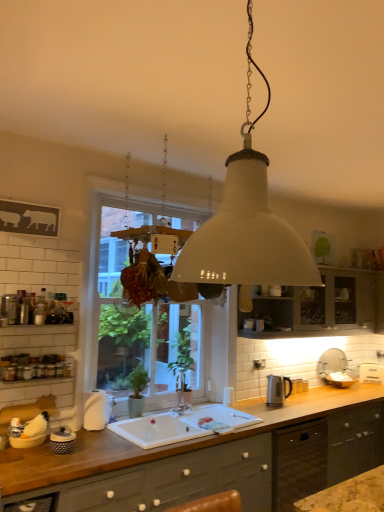
Question: Is matte gray cabinets at lower center, which is the 2th cabinetry from right to left, wider than white ceramic sink at center?

Choices:
 (A) no
 (B) yes

Answer: (B)

Question: From a real-world perspective, is matte gray cabinets at lower center, placed as the 2th cabinetry when sorted from top to bottom, over white ceramic sink at center?

Choices:
 (A) yes
 (B) no

Answer: (B)

Question: Could you tell me if matte gray cabinets at lower center, arranged as the first cabinetry when viewed from the front, is facing white ceramic sink at center?

Choices:
 (A) yes
 (B) no

Answer: (B)

Question: Is matte gray cabinets at lower center, the first cabinetry from the bottom, shorter than white ceramic sink at center?

Choices:
 (A) no
 (B) yes

Answer: (A)

Question: From the image's perspective, would you say matte gray cabinets at lower center, the 1th cabinetry positioned from the left, is positioned over white ceramic sink at center?

Choices:
 (A) no
 (B) yes

Answer: (A)

Question: Can you confirm if matte gray cabinets at lower center, the second cabinetry from the back, is taller than white ceramic sink at center?

Choices:
 (A) yes
 (B) no

Answer: (A)

Question: Can you confirm if white glass window at center is smaller than matte gray cabinet at center, positioned as the 1th cabinetry in back-to-front order?

Choices:
 (A) yes
 (B) no

Answer: (B)

Question: Is white glass window at center looking in the opposite direction of matte gray cabinet at center, positioned as the 1th cabinetry in back-to-front order?

Choices:
 (A) no
 (B) yes

Answer: (A)

Question: Could you tell me if white glass window at center is facing matte gray cabinet at center, positioned as the 2th cabinetry in left-to-right order?

Choices:
 (A) no
 (B) yes

Answer: (A)

Question: Is white glass window at center to the right of matte gray cabinet at center, the 2th cabinetry when ordered from bottom to top, from the viewer's perspective?

Choices:
 (A) no
 (B) yes

Answer: (A)

Question: From the image's perspective, is white glass window at center under matte gray cabinet at center, the second cabinetry when ordered from front to back?

Choices:
 (A) no
 (B) yes

Answer: (A)

Question: From a real-world perspective, is white glass window at center on matte gray cabinet at center, positioned as the 1th cabinetry in back-to-front order?

Choices:
 (A) no
 (B) yes

Answer: (A)

Question: Is white ceramic sink at center oriented towards white matte lampshade at center?

Choices:
 (A) no
 (B) yes

Answer: (A)